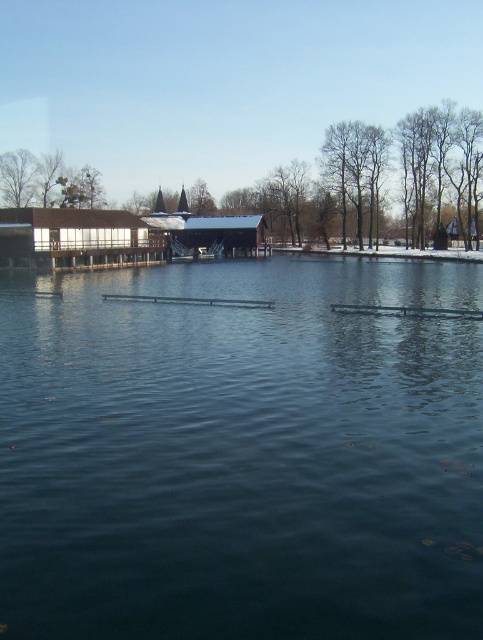
Question: Does dark blue water at center appear on the right side of brown leafless tree at left?

Choices:
 (A) yes
 (B) no

Answer: (A)

Question: Which of the following is the closest to the observer?

Choices:
 (A) brown leafless tree at left
 (B) dark blue water at center

Answer: (B)

Question: Among these points, which one is nearest to the camera?

Choices:
 (A) (32, 200)
 (B) (342, 630)

Answer: (B)

Question: Which of the following is the farthest from the observer?

Choices:
 (A) brown leafless tree at left
 (B) dark blue water at center

Answer: (A)

Question: Is dark blue water at center bigger than brown leafless tree at left?

Choices:
 (A) yes
 (B) no

Answer: (A)

Question: Does dark blue water at center have a larger size compared to brown leafless tree at left?

Choices:
 (A) yes
 (B) no

Answer: (A)